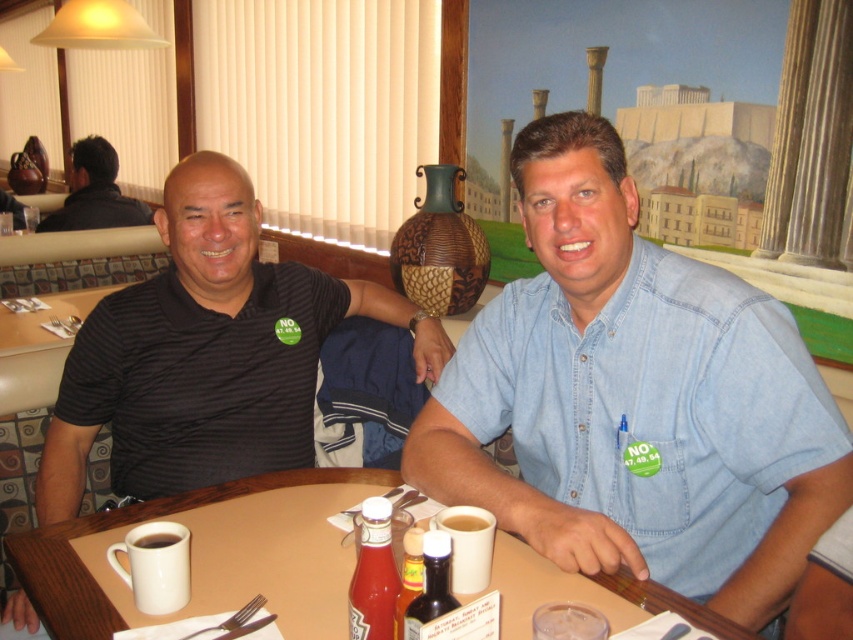
Question: Which object is farther from the camera taking this photo?

Choices:
 (A) black shirt at upper left
 (B) denim shirt at center
 (C) translucent plastic cup at center
 (D) translucent glass bottle at center

Answer: (A)

Question: Is wooden table at center wider than black shirt at upper left?

Choices:
 (A) no
 (B) yes

Answer: (B)

Question: Which point is farther from the camera taking this photo?

Choices:
 (A) (99, 216)
 (B) (30, 532)
 (C) (546, 618)
 (D) (428, 580)

Answer: (A)

Question: Does black striped polo shirt at left appear on the left side of translucent glass bottle at center?

Choices:
 (A) no
 (B) yes

Answer: (B)

Question: Which of the following is the farthest from the observer?

Choices:
 (A) denim shirt at center
 (B) black shirt at upper left
 (C) translucent glass bottle at center
 (D) translucent plastic cup at center

Answer: (B)

Question: Does translucent glass bottle at center lie behind translucent plastic cup at center?

Choices:
 (A) yes
 (B) no

Answer: (B)